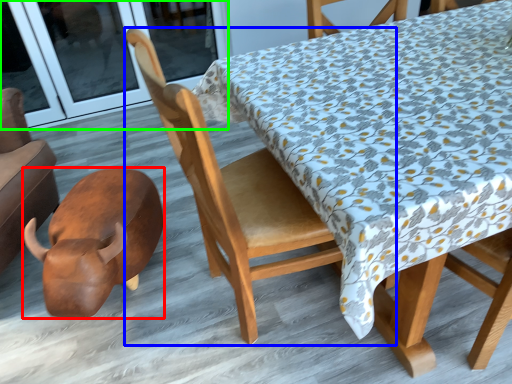
Question: Considering the real-world distances, which object is closest to animal (highlighted by a red box)? chair (highlighted by a blue box) or screen door (highlighted by a green box).

Choices:
 (A) chair
 (B) screen door

Answer: (A)